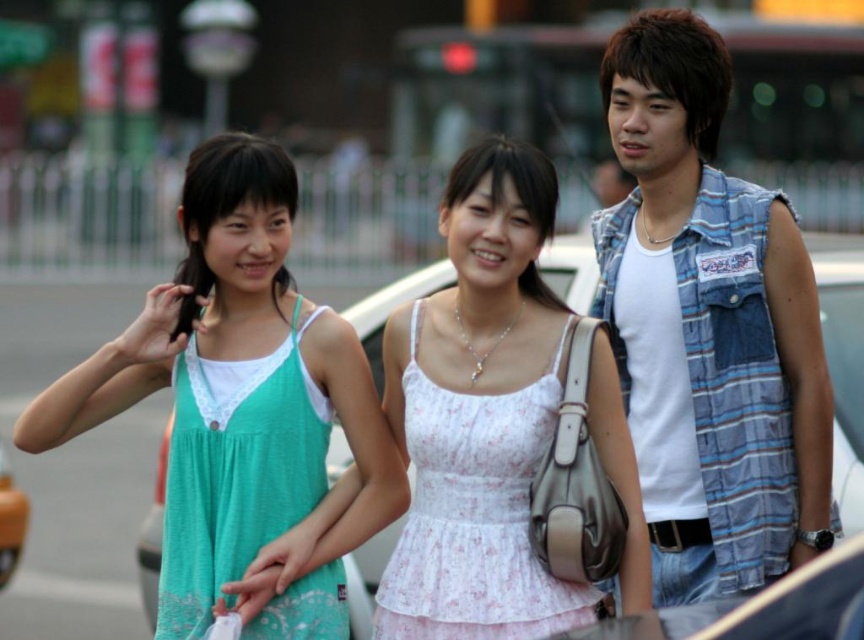
Which of these two, blue plaid vest at right or teal fabric dress at left, stands shorter?

With less height is teal fabric dress at left.

Based on the photo, does blue plaid vest at right have a greater height compared to teal fabric dress at left?

Yes.

The height and width of the screenshot is (640, 864). Describe the element at coordinates (708, 326) in the screenshot. I see `blue plaid vest at right` at that location.

Locate an element on the screen. The width and height of the screenshot is (864, 640). blue plaid vest at right is located at coordinates tap(708, 326).

Who is more forward, (326,570) or (473,358)?

Point (473,358) is more forward.

Looking at this image, which of these two, teal fabric dress at left or white floral dress at center, stands shorter?

white floral dress at center is shorter.

Who is more forward, (182, 486) or (432, 600)?

Point (432, 600)

Locate an element on the screen. The image size is (864, 640). teal fabric dress at left is located at coordinates (239, 404).

Which of these two, blue plaid vest at right or white floral dress at center, stands shorter?

With less height is white floral dress at center.

Does point (777, 449) lie in front of point (418, 520)?

That is True.

Locate an element on the screen. The image size is (864, 640). blue plaid vest at right is located at coordinates (708, 326).